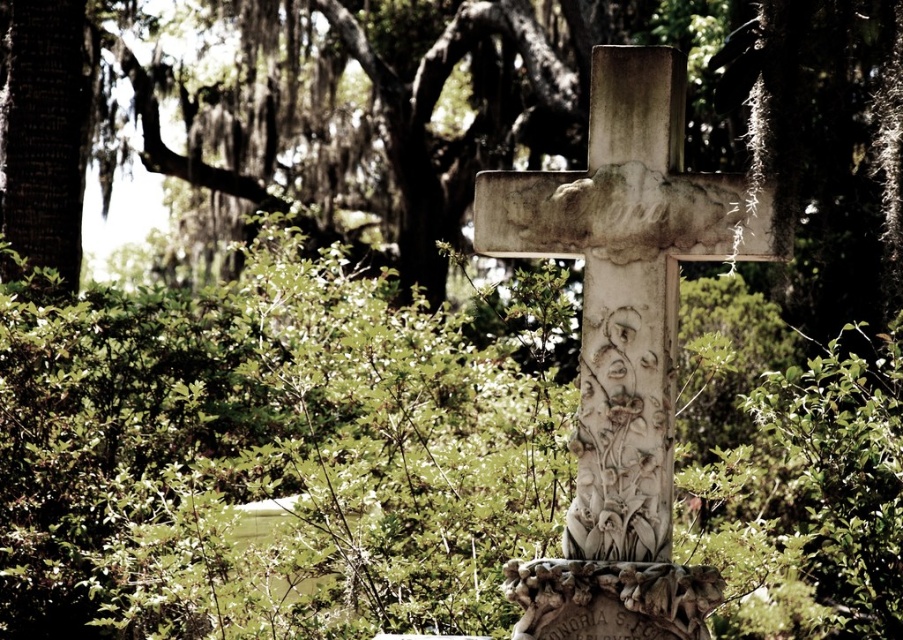
Is point (164, 436) closer to camera compared to point (699, 602)?

No.

What do you see at coordinates (272, 452) in the screenshot?
I see `green leafy bush at center` at bounding box center [272, 452].

This screenshot has width=903, height=640. What are the coordinates of `green leafy bush at center` in the screenshot? It's located at (272, 452).

Is green leafy bush at center smaller than white stone cross at center?

Incorrect, green leafy bush at center is not smaller in size than white stone cross at center.

Does green leafy bush at center have a lesser width compared to white stone cross at center?

In fact, green leafy bush at center might be wider than white stone cross at center.

Where is `green leafy bush at center`? green leafy bush at center is located at coordinates (272, 452).

Is white stone cross at center wider than carved stone gravestone at center?

Yes.

Does white stone cross at center appear over carved stone gravestone at center?

Yes.

This screenshot has height=640, width=903. What do you see at coordinates (625, 284) in the screenshot?
I see `white stone cross at center` at bounding box center [625, 284].

Find the location of `white stone cross at center`. white stone cross at center is located at coordinates (625, 284).